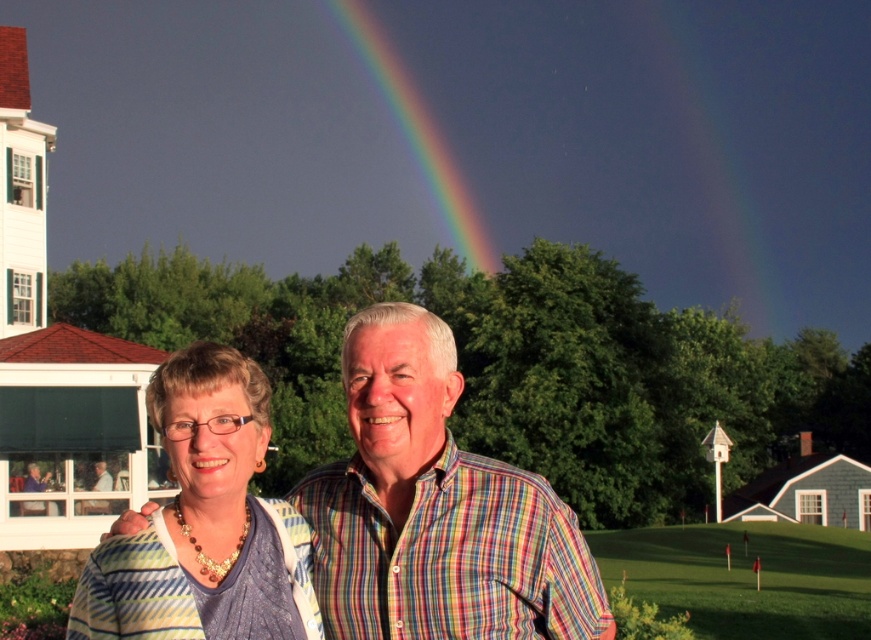
Question: Which point is farther to the camera?

Choices:
 (A) (193, 460)
 (B) (861, 616)

Answer: (B)

Question: Does striped cotton shirt at center have a larger size compared to striped fabric shirt at center?

Choices:
 (A) no
 (B) yes

Answer: (A)

Question: Which of the following is the farthest from the observer?

Choices:
 (A) (92, 592)
 (B) (413, 477)
 (C) (440, 204)

Answer: (C)

Question: Which point is farther from the camera taking this photo?

Choices:
 (A) (96, 502)
 (B) (102, 589)
 (C) (359, 465)
 (D) (377, 33)

Answer: (D)

Question: Is the position of rainbow at upper center more distant than that of matte black shirt at center?

Choices:
 (A) yes
 (B) no

Answer: (A)

Question: Can you confirm if striped fabric shirt at center is thinner than green grass at lower right?

Choices:
 (A) yes
 (B) no

Answer: (A)